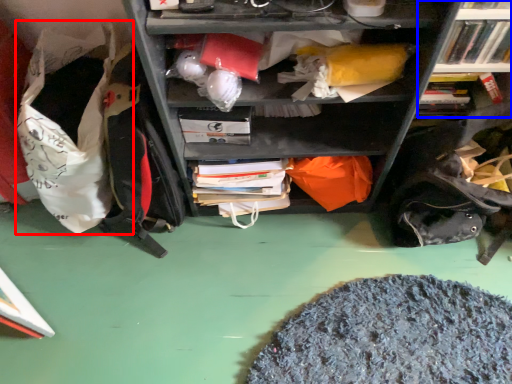
Question: Among these objects, which one is nearest to the camera, bean bag chair (highlighted by a red box) or bookcase (highlighted by a blue box)?

Choices:
 (A) bean bag chair
 (B) bookcase

Answer: (A)